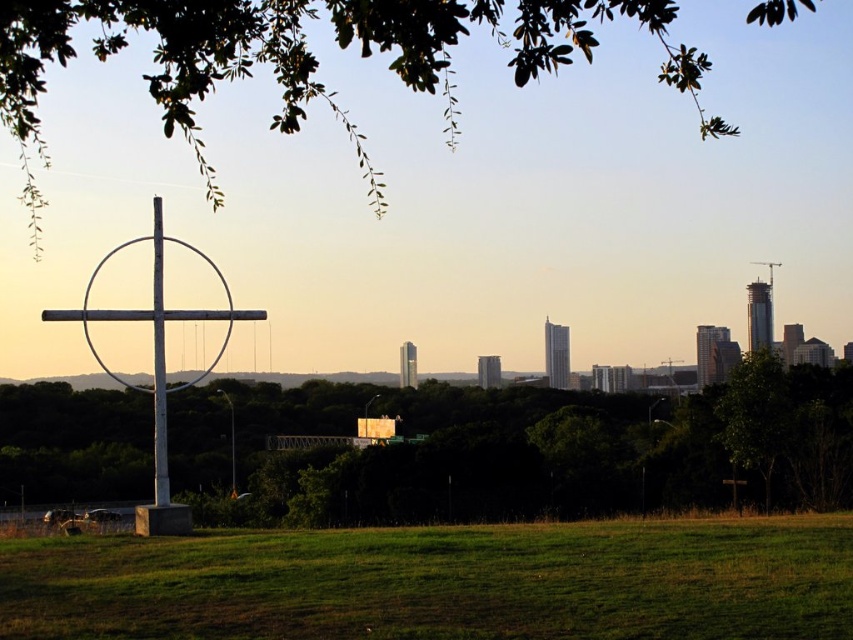
Does green grass at lower center have a lesser width compared to white painted wood cross at left?

No, green grass at lower center is not thinner than white painted wood cross at left.

This screenshot has width=853, height=640. What do you see at coordinates (440, 582) in the screenshot?
I see `green grass at lower center` at bounding box center [440, 582].

Between point (91, 570) and point (219, 275), which one is positioned behind?

The point (219, 275) is more distant.

At what (x,y) coordinates should I click in order to perform the action: click on green grass at lower center. Please return your answer as a coordinate pair (x, y). The width and height of the screenshot is (853, 640). Looking at the image, I should click on (440, 582).

Can you confirm if green grass at lower center is positioned to the right of green leafy tree at lower center?

Correct, you'll find green grass at lower center to the right of green leafy tree at lower center.

Is green grass at lower center taller than green leafy tree at lower center?

Incorrect, green grass at lower center's height is not larger of green leafy tree at lower center's.

At what (x,y) coordinates should I click in order to perform the action: click on green grass at lower center. Please return your answer as a coordinate pair (x, y). This screenshot has height=640, width=853. Looking at the image, I should click on (440, 582).

Locate an element on the screen. The width and height of the screenshot is (853, 640). green grass at lower center is located at coordinates point(440,582).

Which of these two, green grass at lower center or metallic pole at left, stands shorter?

green grass at lower center

What do you see at coordinates (440, 582) in the screenshot?
I see `green grass at lower center` at bounding box center [440, 582].

Does point (842, 538) lie behind point (157, 392)?

No, it is not.

The height and width of the screenshot is (640, 853). I want to click on green grass at lower center, so click(x=440, y=582).